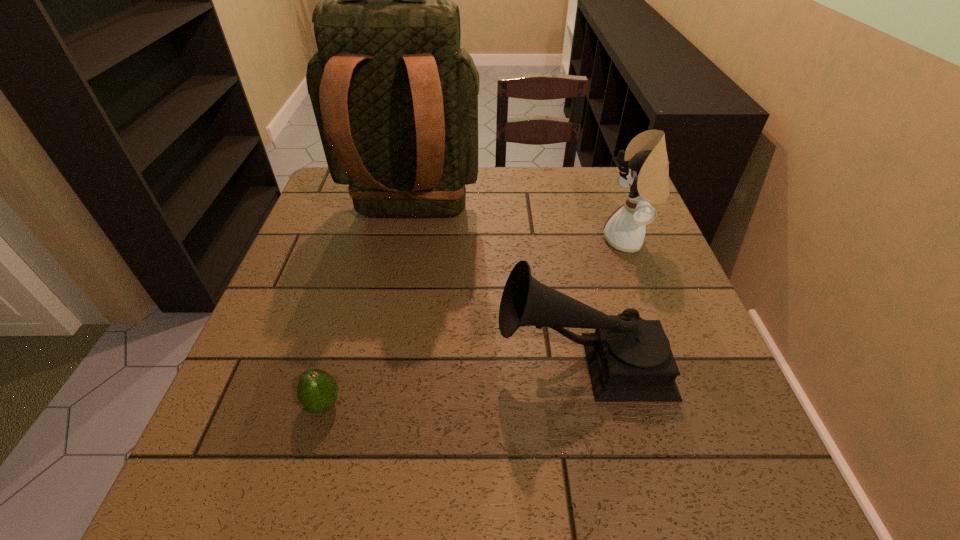
Where is `vacant space at the left edge`? This screenshot has height=540, width=960. vacant space at the left edge is located at coordinates (347, 291).

The height and width of the screenshot is (540, 960). I want to click on free region at the right edge, so click(x=722, y=376).

Identify the location of vacant region at the near left corner of the desktop. coord(225,470).

Image resolution: width=960 pixels, height=540 pixels. What are the coordinates of `vacant area at the far right corner` in the screenshot? It's located at click(x=588, y=186).

Locate an element on the screen. Image resolution: width=960 pixels, height=540 pixels. free space at the near right corner of the desktop is located at coordinates (702, 477).

Image resolution: width=960 pixels, height=540 pixels. Identify the location of unoccupied area between the tallest object and the shortest object. (368, 309).

At what (x,y) coordinates should I click in order to perform the action: click on free area in between the tallest object and the avocado. Please return your answer as a coordinate pair (x, y). This screenshot has width=960, height=540. Looking at the image, I should click on (368, 309).

Locate an element on the screen. empty location between the shortest object and the second tallest object is located at coordinates (476, 322).

The height and width of the screenshot is (540, 960). Identify the location of vacant space that's between the shortest object and the third shortest object. (476, 322).

I want to click on vacant region between the avocado and the phonograph_record, so click(452, 382).